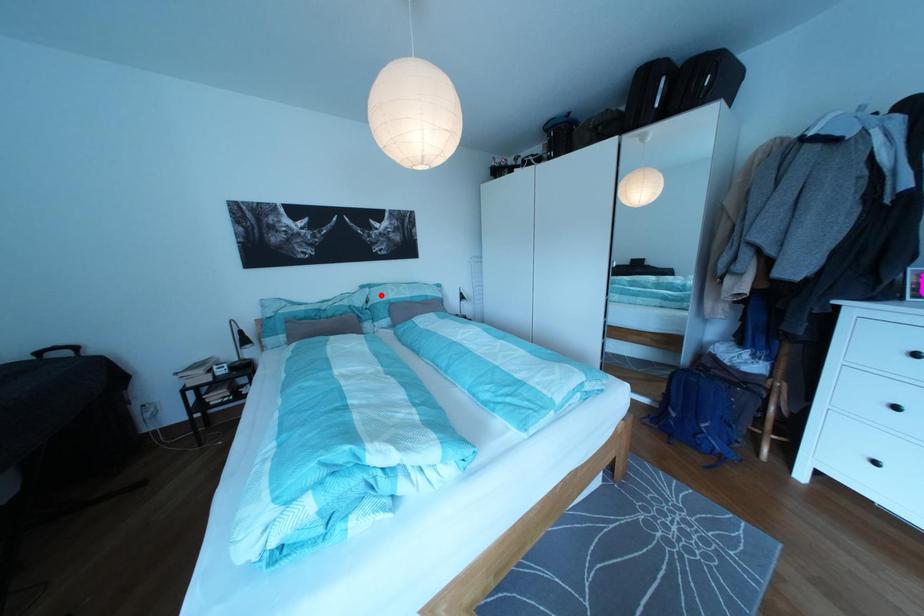
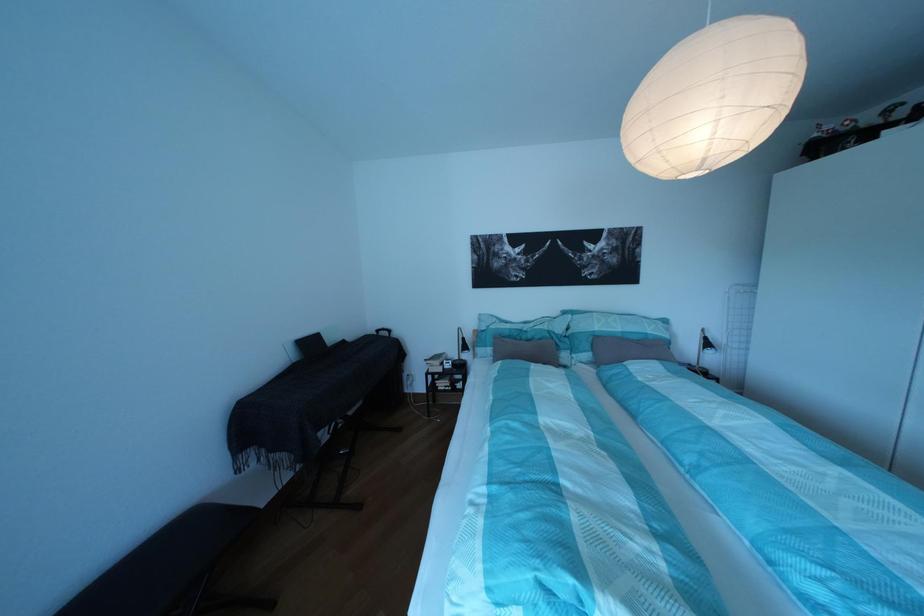
The point at the highlighted location is marked in the first image. Where is the corresponding point in the second image?

(582, 322)